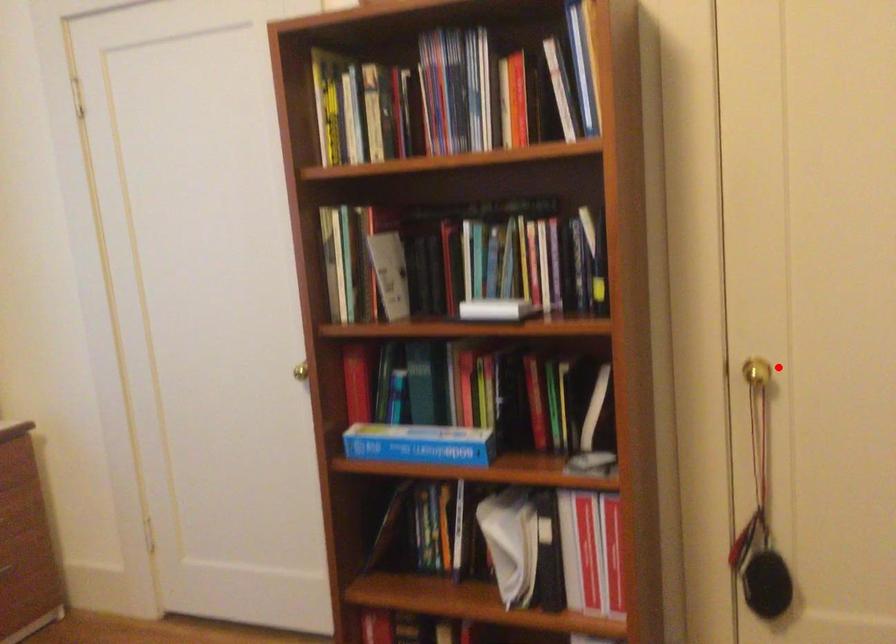
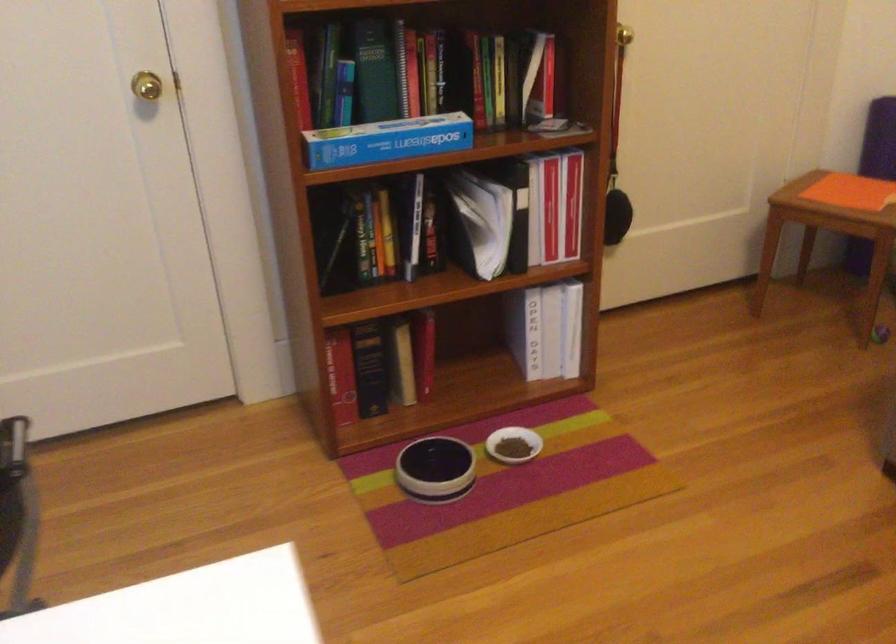
Question: I am providing you with two images of the same scene from different viewpoints. Image1 has a red point marked. In image2, the corresponding 3D location appears at what relative position? Reply with the corresponding letter.

Choices:
 (A) Closer
 (B) Farther

Answer: (B)